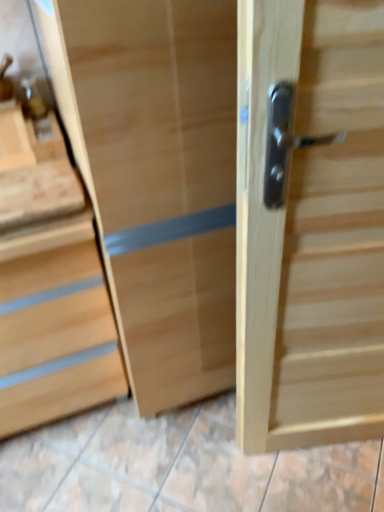
Question: Does natural wood chest of drawers at left lie behind natural wood door handle at right?

Choices:
 (A) yes
 (B) no

Answer: (A)

Question: Considering the relative sizes of natural wood chest of drawers at left and natural wood door handle at right in the image provided, is natural wood chest of drawers at left thinner than natural wood door handle at right?

Choices:
 (A) yes
 (B) no

Answer: (B)

Question: Is natural wood chest of drawers at left far away from natural wood door handle at right?

Choices:
 (A) no
 (B) yes

Answer: (A)

Question: Is natural wood chest of drawers at left oriented away from natural wood door handle at right?

Choices:
 (A) no
 (B) yes

Answer: (A)

Question: Is natural wood chest of drawers at left not within natural wood door handle at right?

Choices:
 (A) yes
 (B) no

Answer: (A)

Question: Is natural wood chest of drawers at left smaller than natural wood door handle at right?

Choices:
 (A) yes
 (B) no

Answer: (B)

Question: Can you confirm if natural wood door handle at right is smaller than natural wood chest of drawers at left?

Choices:
 (A) no
 (B) yes

Answer: (B)

Question: Does natural wood door handle at right turn towards natural wood chest of drawers at left?

Choices:
 (A) yes
 (B) no

Answer: (B)

Question: From a real-world perspective, does natural wood door handle at right sit lower than natural wood chest of drawers at left?

Choices:
 (A) no
 (B) yes

Answer: (A)

Question: Is natural wood door handle at right not close to natural wood chest of drawers at left?

Choices:
 (A) no
 (B) yes

Answer: (A)

Question: Can you confirm if natural wood door handle at right is wider than natural wood chest of drawers at left?

Choices:
 (A) no
 (B) yes

Answer: (A)

Question: Is natural wood chest of drawers at left completely or partially inside natural wood door handle at right?

Choices:
 (A) no
 (B) yes

Answer: (A)

Question: In terms of width, does natural wood door handle at right look wider or thinner when compared to natural wood chest of drawers at left?

Choices:
 (A) thin
 (B) wide

Answer: (A)